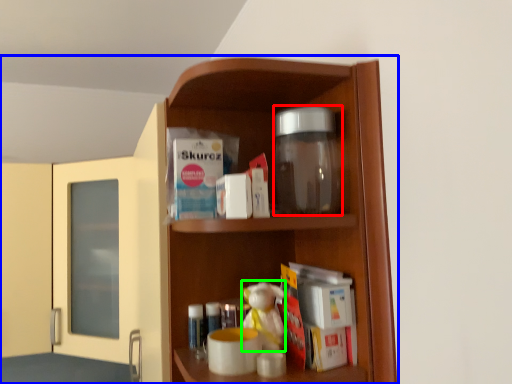
Question: Which object is the closest to the glass jar (highlighted by a red box)? Choose among these: cupboard (highlighted by a blue box) or toy (highlighted by a green box).

Choices:
 (A) cupboard
 (B) toy

Answer: (A)